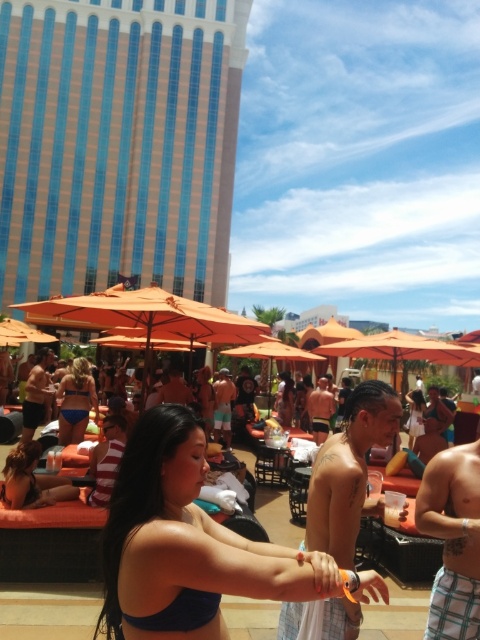
Who is shorter, blue fabric bikini at center or orange fabric shorts at center?

With less height is blue fabric bikini at center.

Between point (162, 627) and point (324, 392), which one is positioned behind?

Positioned behind is point (324, 392).

Find the location of a particular element. This screenshot has height=640, width=480. blue fabric bikini at center is located at coordinates pos(186,544).

Is blue fabric bikini at center shorter than tan skin man at center?

Yes.

Does blue fabric bikini at center appear under tan skin man at center?

Incorrect, blue fabric bikini at center is not positioned below tan skin man at center.

Is point (241, 582) more distant than point (219, 401)?

No, it is in front of (219, 401).

Locate an element on the screen. blue fabric bikini at center is located at coordinates (186, 544).

Can you confirm if shiny metallic arm at center is shorter than plaid shorts at center?

Incorrect, shiny metallic arm at center's height does not fall short of plaid shorts at center's.

Does shiny metallic arm at center have a lesser width compared to plaid shorts at center?

In fact, shiny metallic arm at center might be wider than plaid shorts at center.

Who is more forward, (357, 525) or (456, 449)?

Positioned in front is point (357, 525).

This screenshot has height=640, width=480. Identify the location of shiny metallic arm at center. (348, 472).